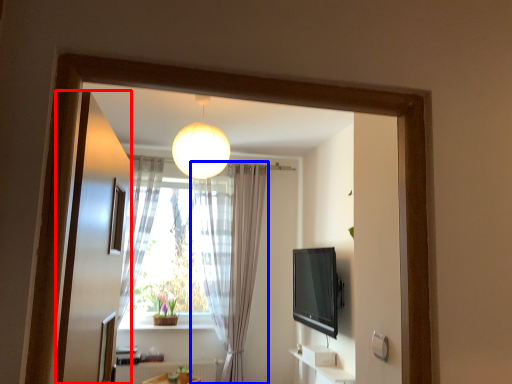
Question: Which object is further to the camera taking this photo, screen door (highlighted by a red box) or curtain (highlighted by a blue box)?

Choices:
 (A) screen door
 (B) curtain

Answer: (B)